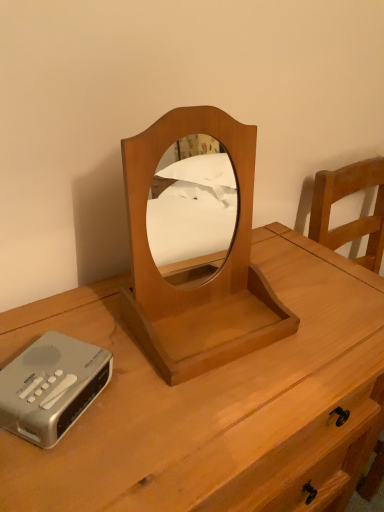
Question: From a real-world perspective, is wooden mirror at center positioned above or below light brown wood nightstand at center?

Choices:
 (A) above
 (B) below

Answer: (A)

Question: Considering the positions of point (251, 233) and point (213, 389), is point (251, 233) closer or farther from the camera than point (213, 389)?

Choices:
 (A) farther
 (B) closer

Answer: (A)

Question: Which object is positioned farthest from the wooden mirror at center?

Choices:
 (A) silver metallic cassette at lower left
 (B) light brown wood nightstand at center

Answer: (A)

Question: Estimate the real-world distances between objects in this image. Which object is closer to the wooden mirror at center?

Choices:
 (A) silver metallic cassette at lower left
 (B) light brown wood nightstand at center

Answer: (B)